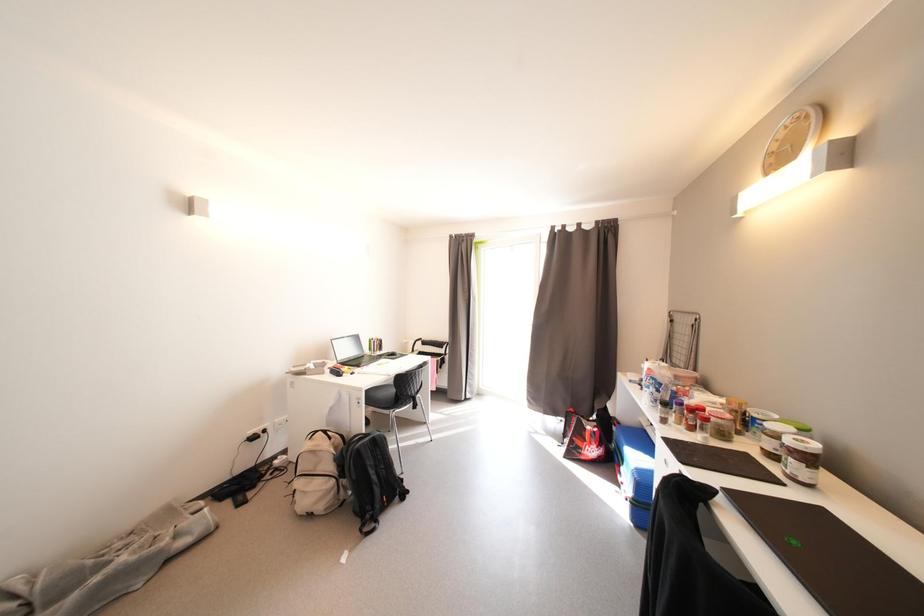
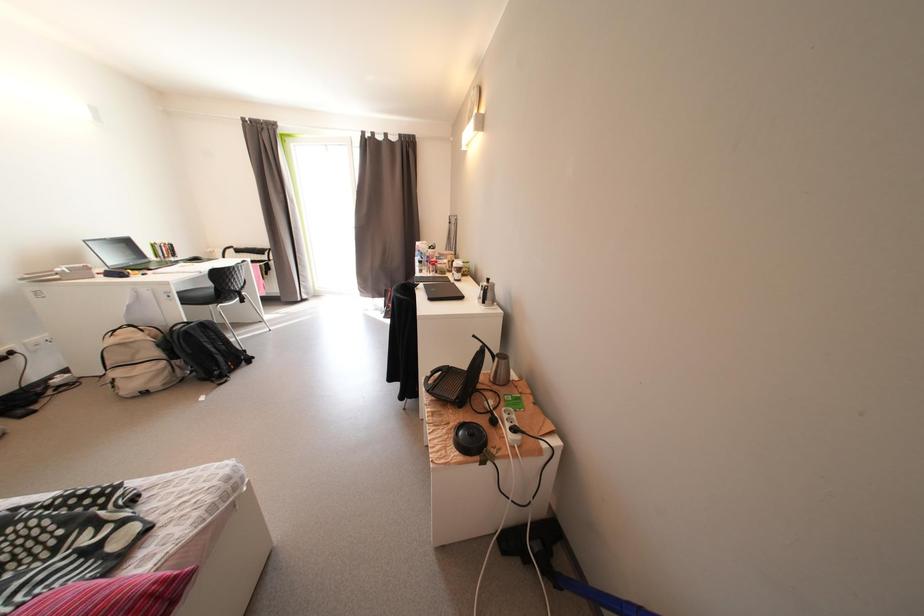
The first image is from the beginning of the video and the second image is from the end. How did the camera likely rotate when shooting the video?

The camera's rotation is toward right-down.